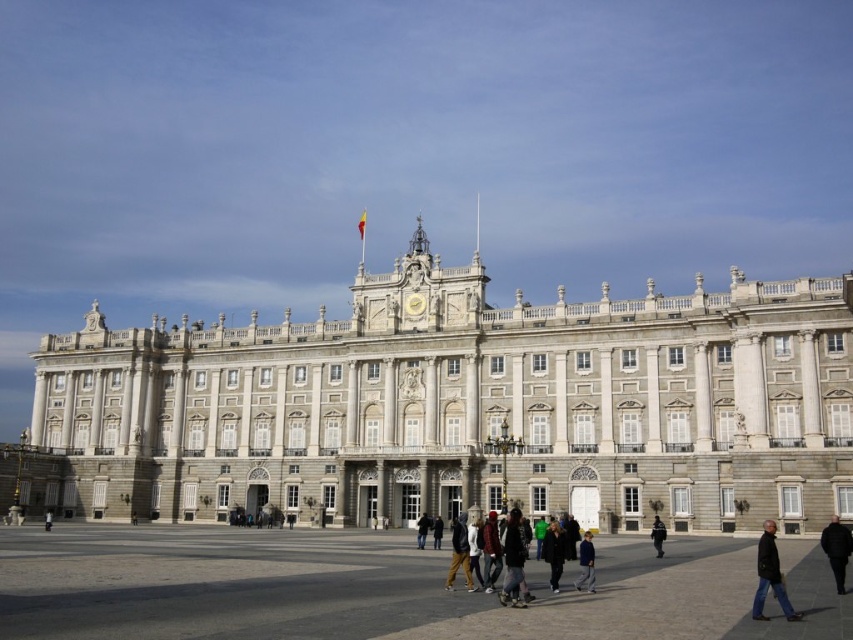
You are a photographer standing in front of the grand historic building. You want to take a photo that includes both the central clock face and the dark brown leather jacket at center. Is the point at coordinate (422, 529) within the area of the dark brown leather jacket at center?

Yes, the point at coordinate (422, 529) is on the dark brown leather jacket at center, so it is within its area.

You are standing in front of the grand historic building and notice a black leather jacket at lower right. Where exactly is the black leather jacket positioned relative to the building?

The black leather jacket at lower right is located at point coordinates approximately 0.900 on the horizontal axis and 0.903 on the vertical axis relative to the building.

You are standing in front of a historic building and see a dark brown leather jacket at center and a black fabric person at lower left. Which object is smaller in size?

The dark brown leather jacket at center is smaller in size compared to the black fabric person at lower left.